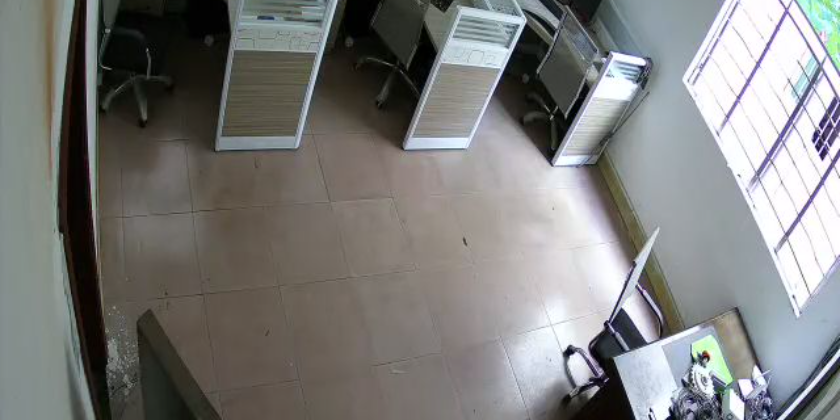
This screenshot has width=840, height=420. I want to click on window, so click(x=811, y=37).